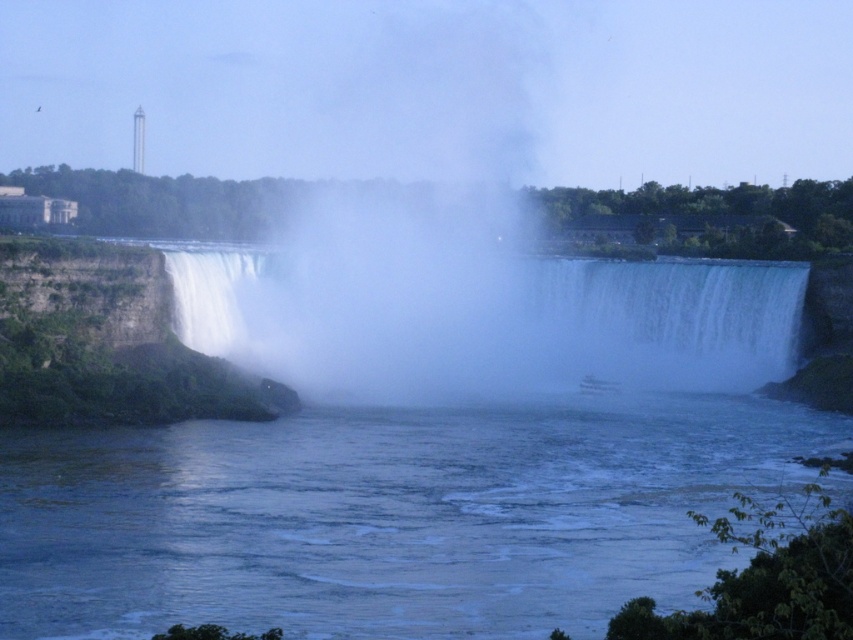
You are a photographer planning to capture the waterfall and the river below. Based on the scene, which object between the clear water at center and the white misty waterfall at center is shorter in height?

The clear water at center is shorter in height than the white misty waterfall at center, as stated in the description that it is not as tall.

You are a photographer planning to capture the waterfall scene. You want to ensure that both the clear water at center and the white misty waterfall at center are visible in your shot. Based on their sizes in the image, which one should you prioritize framing closer to the center of your photo?

The white misty waterfall at center occupies more space than the clear water at center, so you should prioritize framing the white misty waterfall at center closer to the center of your photo to ensure it is prominently displayed.